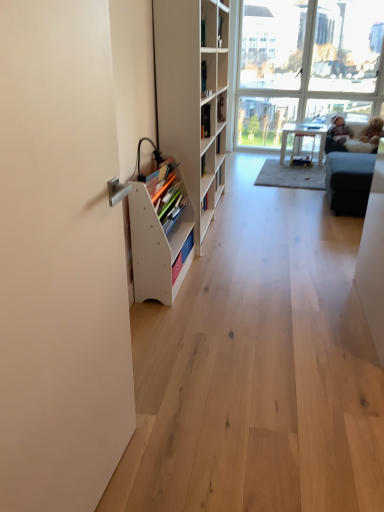
Identify the location of free space in front of white wood bookshelf at left, the first shelf in the bottom-to-top sequence. The width and height of the screenshot is (384, 512). (183, 315).